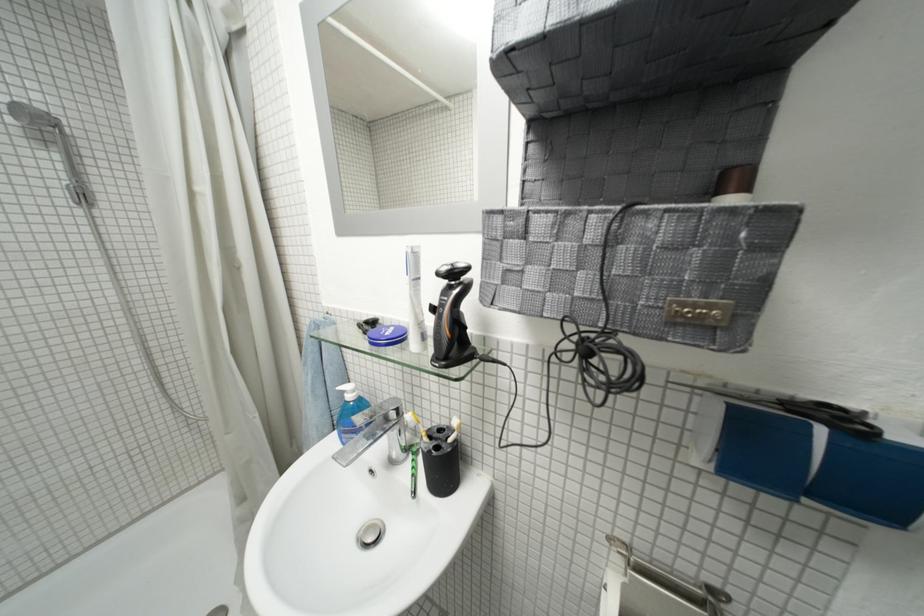
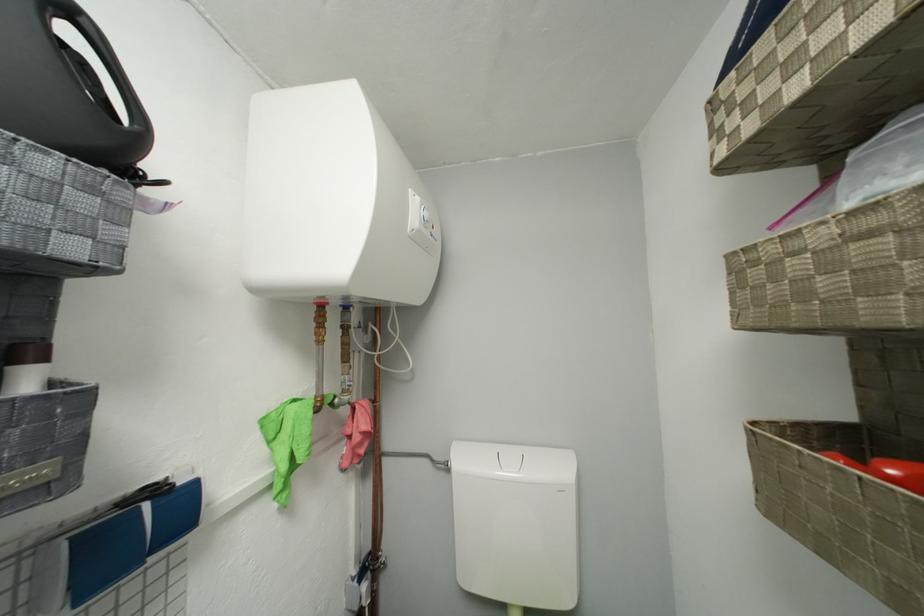
Locate, in the second image, the point that corresponds to the point at 732,326 in the first image.

(66, 477)